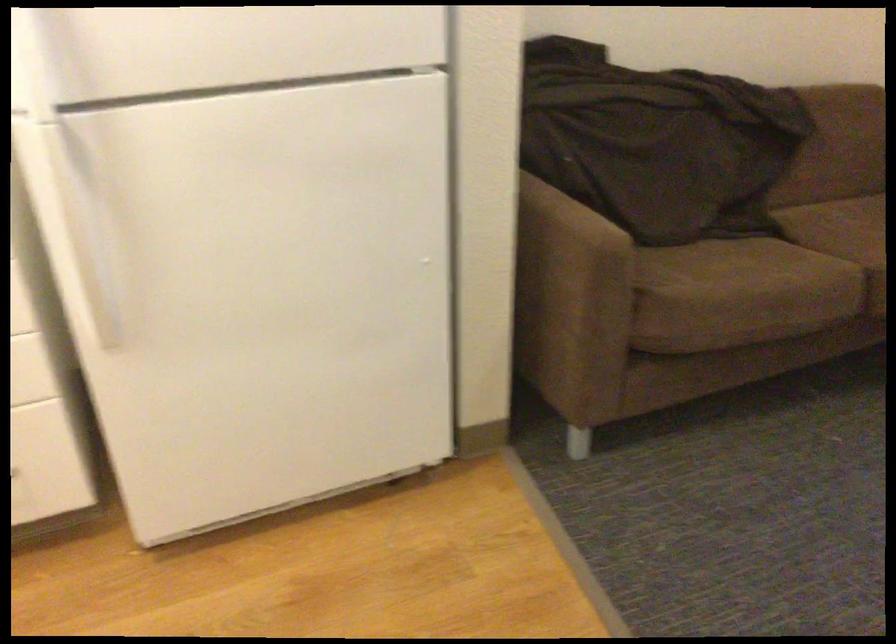
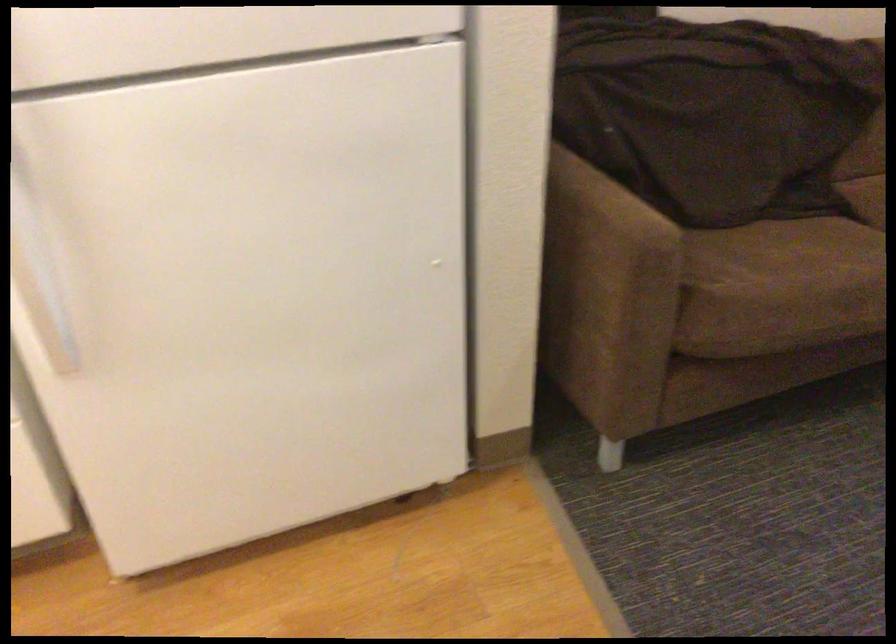
Question: The images are taken continuously from a first-person perspective. In which direction is your viewpoint rotating?

Choices:
 (A) Left
 (B) Right
 (C) Up
 (D) Down

Answer: (D)